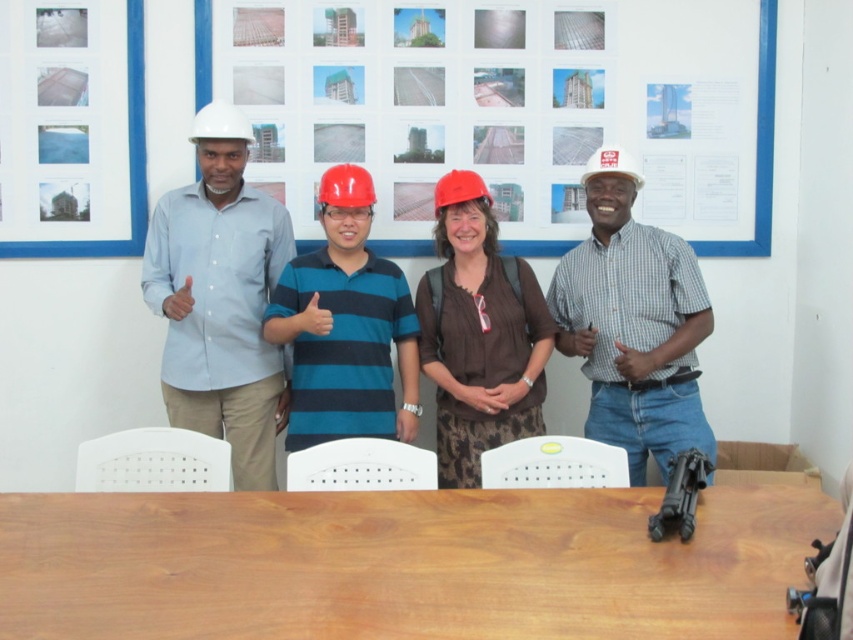
Question: Is matte white hard hat at left smaller than white matte hard hat at right?

Choices:
 (A) no
 (B) yes

Answer: (A)

Question: Considering the real-world distances, which object is farthest from the white matte helmet at left?

Choices:
 (A) matte white hard hat at left
 (B) blue-green striped shirt at center

Answer: (B)

Question: Is red matte helmet at center smaller than white hard hat at upper right?

Choices:
 (A) no
 (B) yes

Answer: (B)

Question: Which point is farther to the camera?

Choices:
 (A) metallic silver construction photos at upper center
 (B) white matte helmet at upper center
 (C) white hard hat at upper right
 (D) matte red helmet at center

Answer: (A)

Question: Where is white matte hard hat at right located in relation to matte red helmet at center in the image?

Choices:
 (A) above
 (B) below

Answer: (B)

Question: Estimate the real-world distances between objects in this image. Which object is farther from the blue-green striped shirt at center?

Choices:
 (A) matte white hard hat at left
 (B) white hard hat at upper right
 (C) metallic silver construction photos at upper center

Answer: (B)